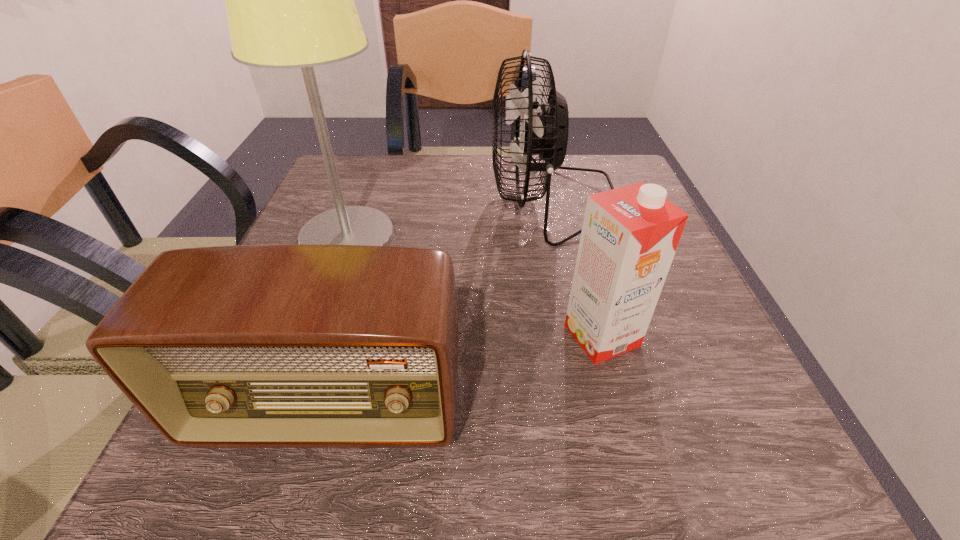
The height and width of the screenshot is (540, 960). In order to click on vacant space that satisfies the following two spatial constraints: 1. in front of the carton, directing airflow; 2. on the left side of the fan in this screenshot , I will do `click(582, 336)`.